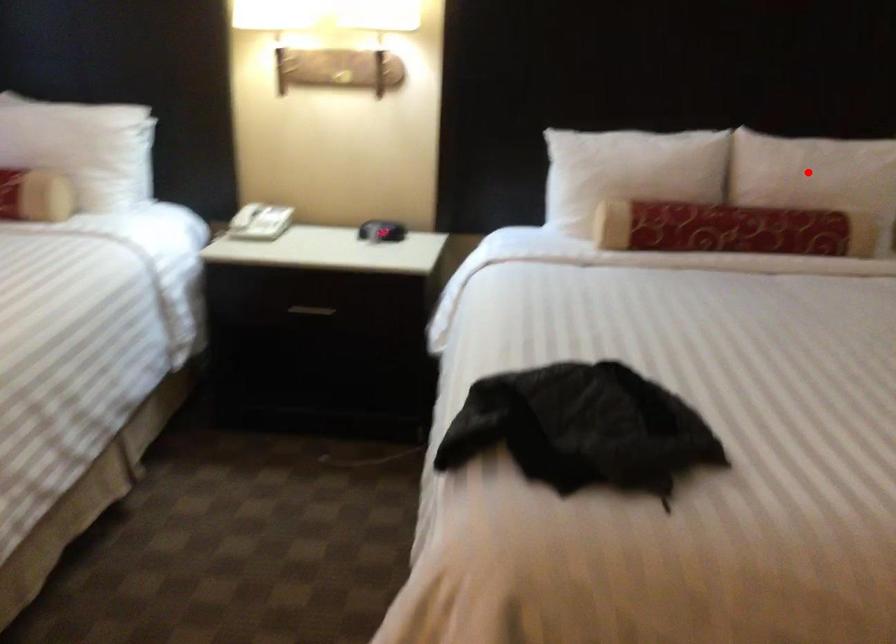
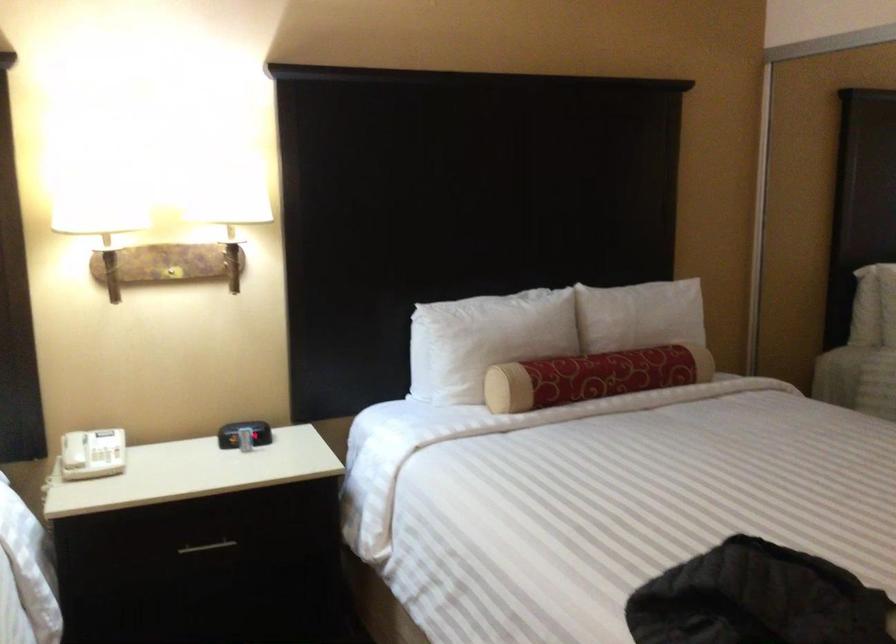
Find the pixel in the second image that matches the highlighted location in the first image.

(643, 319)